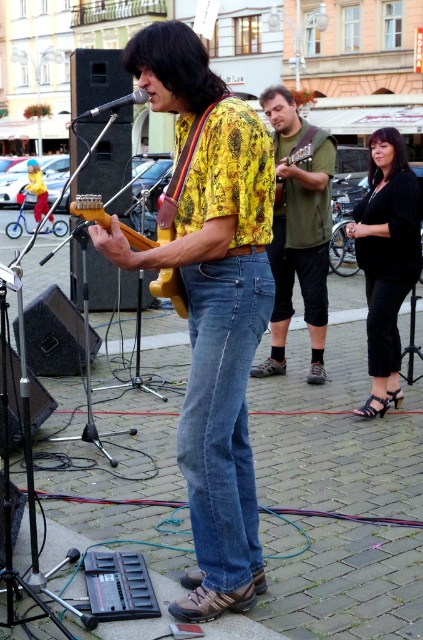
Question: Is dark brown silky hair at upper right positioned behind wooden acoustic guitar at center?

Choices:
 (A) no
 (B) yes

Answer: (A)

Question: Is yellow printed shirt at center further to camera compared to wooden electric guitar at center?

Choices:
 (A) no
 (B) yes

Answer: (A)

Question: Which object is positioned farthest from the green fabric vest at center?

Choices:
 (A) wooden electric guitar at center
 (B) dark brown silky hair at upper right
 (C) wooden acoustic guitar at center
 (D) yellow printed shirt at center

Answer: (D)

Question: Which of the following is the closest to the observer?

Choices:
 (A) yellow printed shirt at center
 (B) wooden acoustic guitar at center
 (C) denim jeans at center
 (D) dark brown silky hair at upper right

Answer: (A)

Question: Where is denim jeans at center located in relation to green fabric vest at center in the image?

Choices:
 (A) left
 (B) right

Answer: (A)

Question: Based on their relative distances, which object is nearer to the wooden electric guitar at center?

Choices:
 (A) dark brown silky hair at upper right
 (B) denim jeans at center
 (C) yellow printed shirt at center
 (D) green fabric vest at center

Answer: (C)